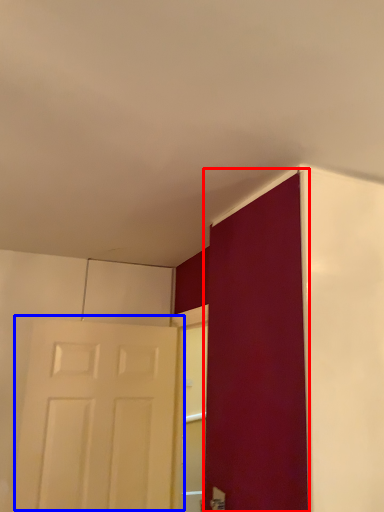
Question: Which point is closer to the camera, door (highlighted by a red box) or door (highlighted by a blue box)?

Choices:
 (A) door
 (B) door

Answer: (A)